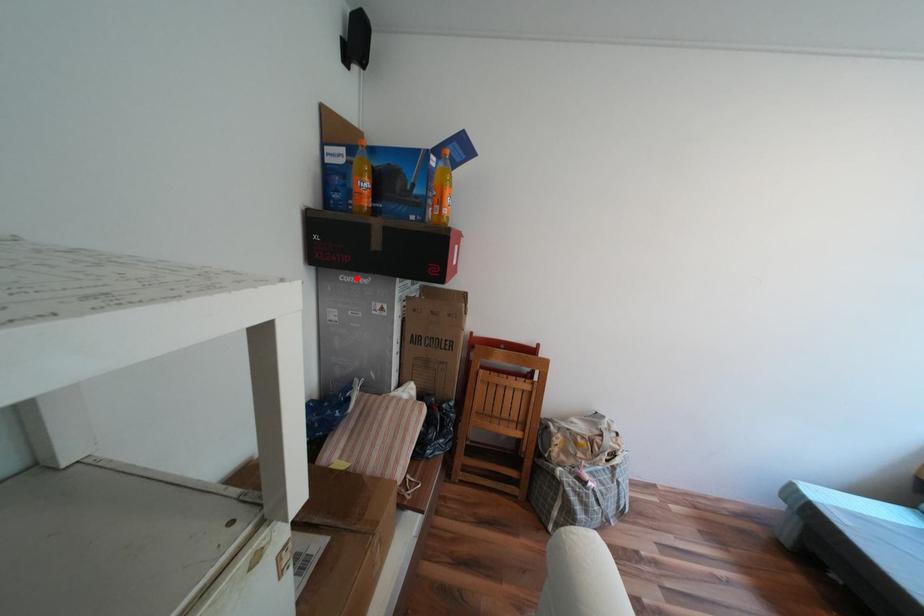
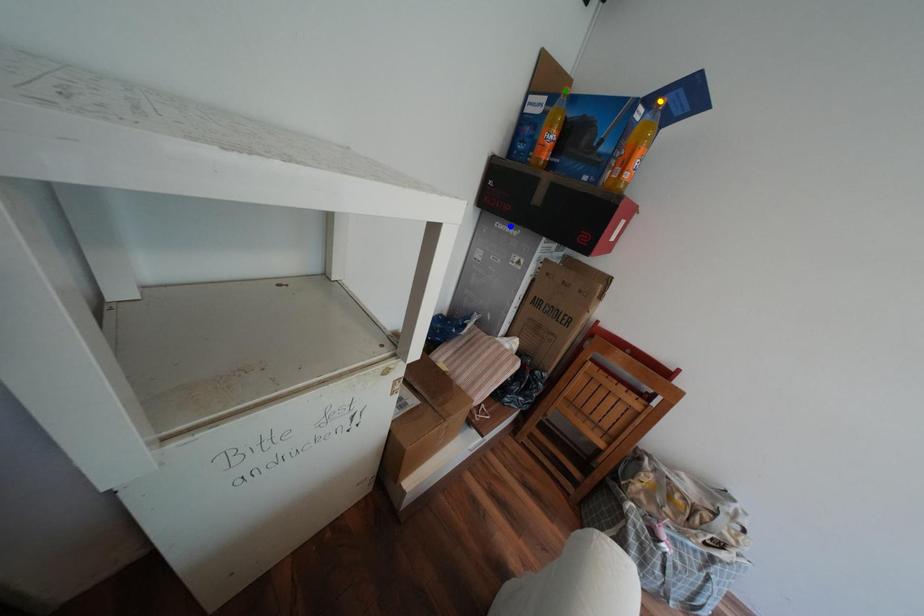
Question: I am providing you with two images of the same scene from different viewpoints. A red point is marked on the first image. You are given multiple points on the second image. Which spot in image 2 lines up with the point in image 1?

Choices:
 (A) blue point
 (B) green point
 (C) yellow point

Answer: (A)